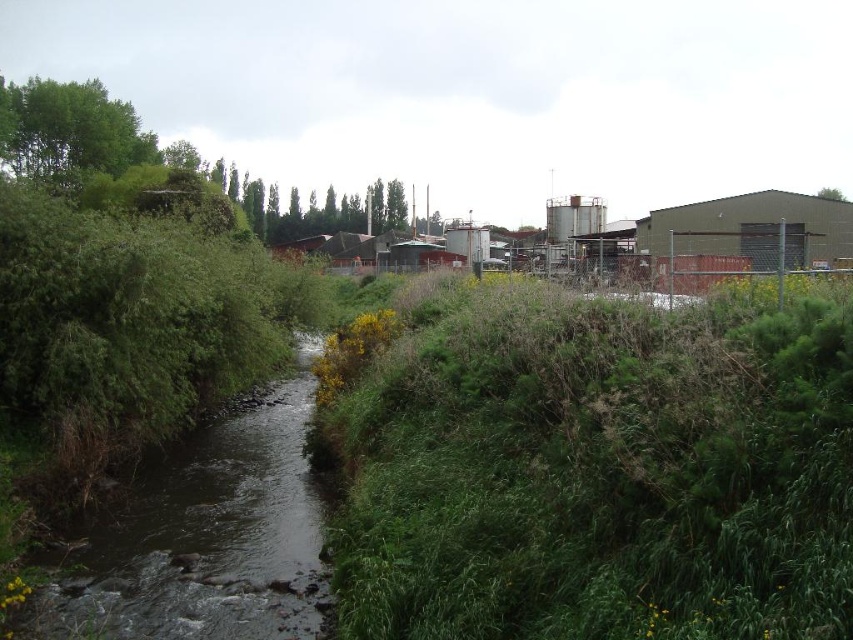
Question: Does green grassy patch at center appear on the right side of dark brown water at center?

Choices:
 (A) no
 (B) yes

Answer: (B)

Question: Observing the image, what is the correct spatial positioning of green grassy patch at center in reference to dark brown water at center?

Choices:
 (A) left
 (B) right

Answer: (B)

Question: Which of the following is the farthest from the observer?

Choices:
 (A) (306, 392)
 (B) (665, 344)

Answer: (A)

Question: Does green grassy patch at center have a smaller size compared to dark brown water at center?

Choices:
 (A) no
 (B) yes

Answer: (B)

Question: Which of the following is the closest to the observer?

Choices:
 (A) dark brown water at center
 (B) green grassy patch at center

Answer: (B)